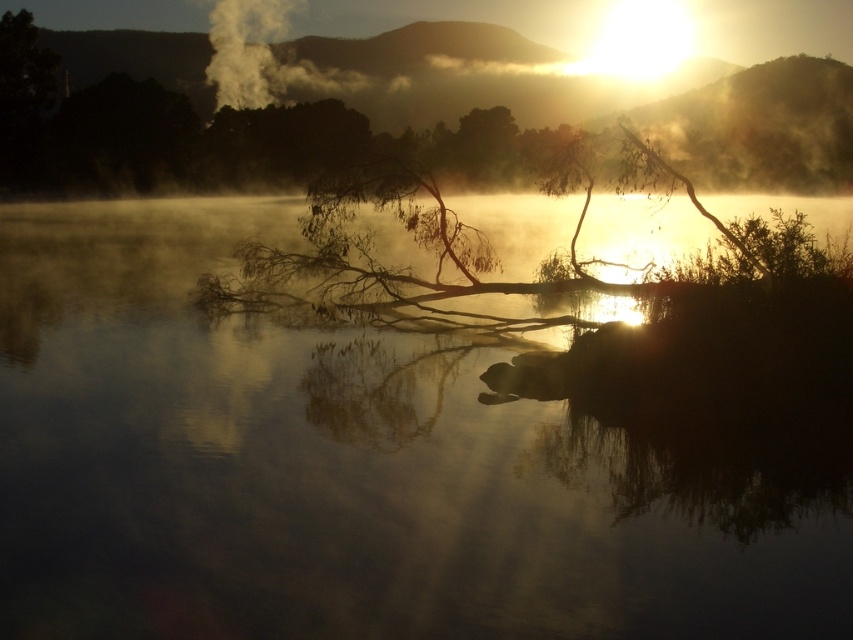
Question: Which is nearer to the white smoke at upper center?

Choices:
 (A) transparent water at center
 (B) brown/dry wood tree at center
 (C) foggy mist at upper center

Answer: (C)

Question: Can you confirm if brown/dry wood tree at center is positioned above white smoke at upper center?

Choices:
 (A) no
 (B) yes

Answer: (A)

Question: Is foggy mist at upper center wider than brown/dry wood tree at center?

Choices:
 (A) yes
 (B) no

Answer: (A)

Question: Is transparent water at center above white smoke at upper center?

Choices:
 (A) no
 (B) yes

Answer: (A)

Question: Estimate the real-world distances between objects in this image. Which object is farther from the white smoke at upper center?

Choices:
 (A) brown/dry wood tree at center
 (B) transparent water at center
 (C) foggy mist at upper center

Answer: (B)

Question: Based on their relative distances, which object is nearer to the foggy mist at upper center?

Choices:
 (A) transparent water at center
 (B) white smoke at upper center

Answer: (B)